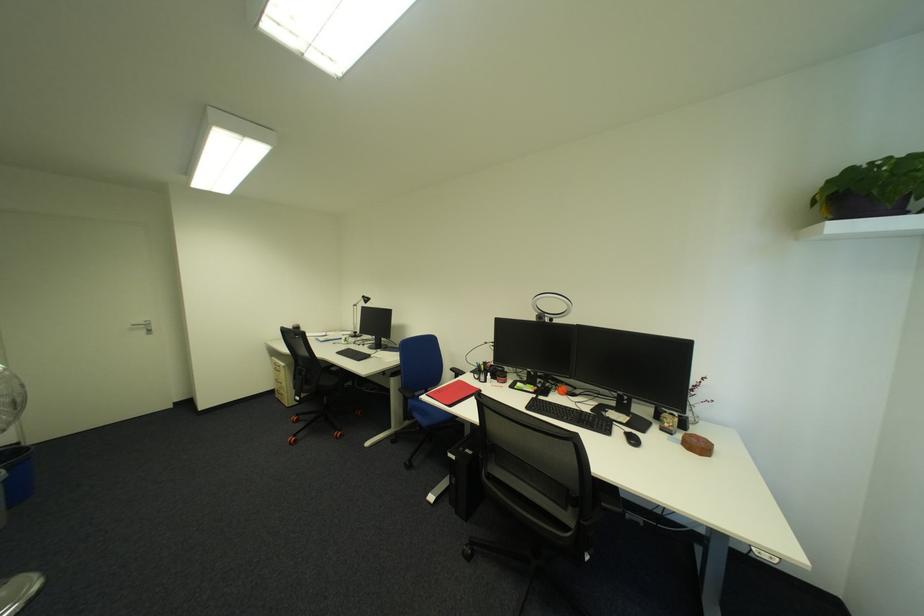
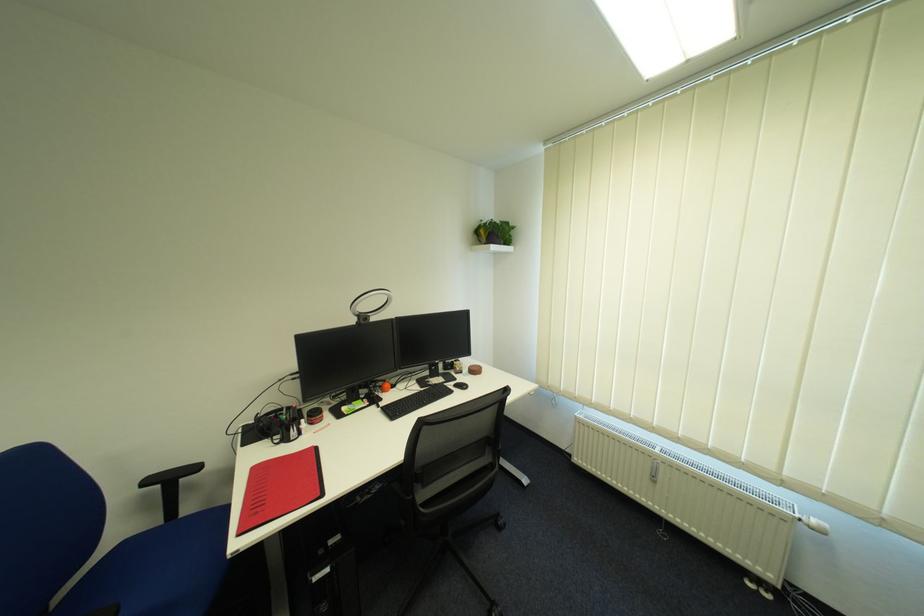
Find the pixel in the second image that matches (x=858, y=191) in the first image.

(503, 233)